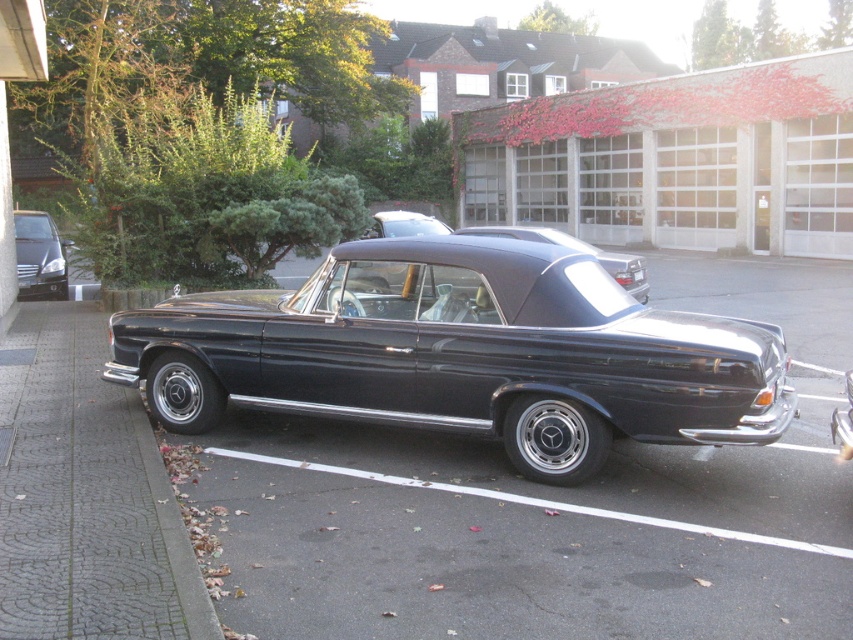
Is the position of shiny black convertible at center less distant than that of glossy black convertible at center?

Yes, shiny black convertible at center is closer to the viewer.

Can you confirm if shiny black convertible at center is shorter than glossy black convertible at center?

Yes, shiny black convertible at center is shorter than glossy black convertible at center.

Who is more distant from viewer, [440,378] or [619,260]?

The point [619,260] is behind.

Locate an element on the screen. The width and height of the screenshot is (853, 640). shiny black convertible at center is located at coordinates (463, 353).

Is shiny black convertible at center thinner than matte black car at left?

In fact, shiny black convertible at center might be wider than matte black car at left.

Which is in front, point (614, 324) or point (62, 272)?

Point (614, 324)

Who is more forward, (784, 424) or (38, 259)?

Point (784, 424)

Where is `shiny black convertible at center`? shiny black convertible at center is located at coordinates (463, 353).

How far apart are matte black car at left and glossy black convertible at center?

The distance of matte black car at left from glossy black convertible at center is 11.46 meters.

Is point (67, 282) closer to camera compared to point (560, 237)?

That is False.

You are a GUI agent. You are given a task and a screenshot of the screen. Output one action in this format:
    pyautogui.click(x=<x>, y=<y>)
    Task: Click on the matte black car at left
    
    Given the screenshot: What is the action you would take?
    pyautogui.click(x=39, y=256)